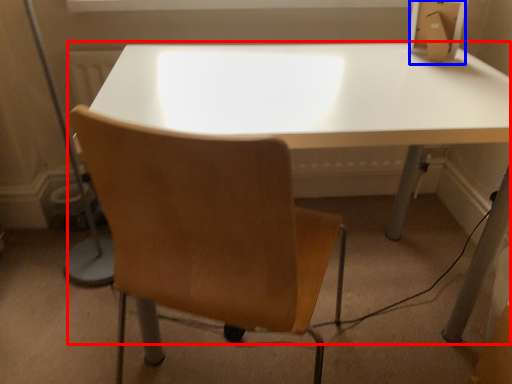
Question: Which point is further to the camera, table (highlighted by a red box) or cardboard box (highlighted by a blue box)?

Choices:
 (A) table
 (B) cardboard box

Answer: (B)